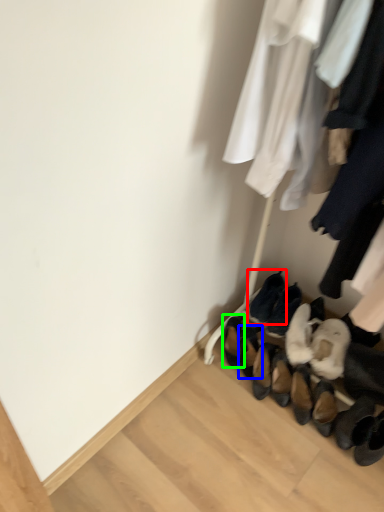
Question: Considering the real-world distances, which object is closest to footwear (highlighted by a red box)? footwear (highlighted by a blue box) or footwear (highlighted by a green box).

Choices:
 (A) footwear
 (B) footwear

Answer: (A)